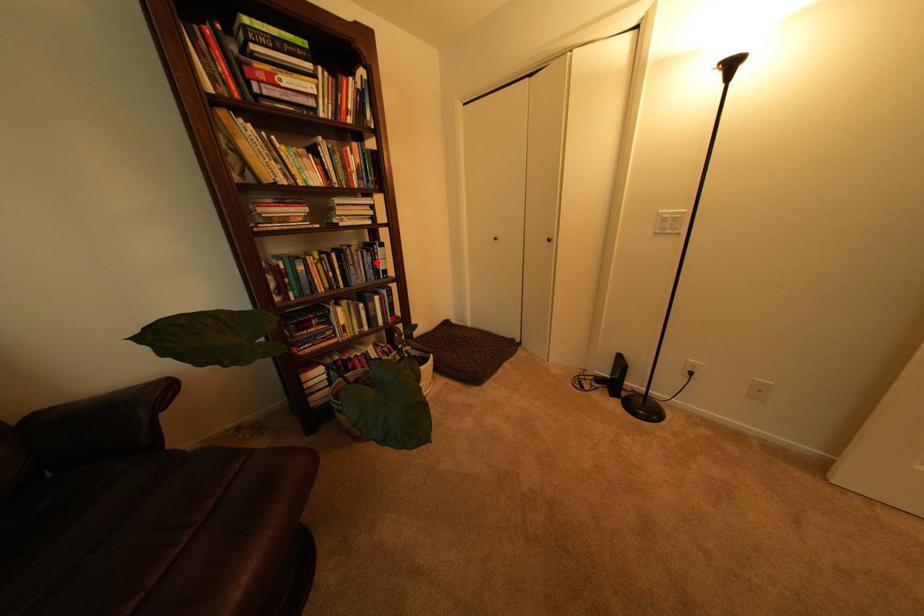
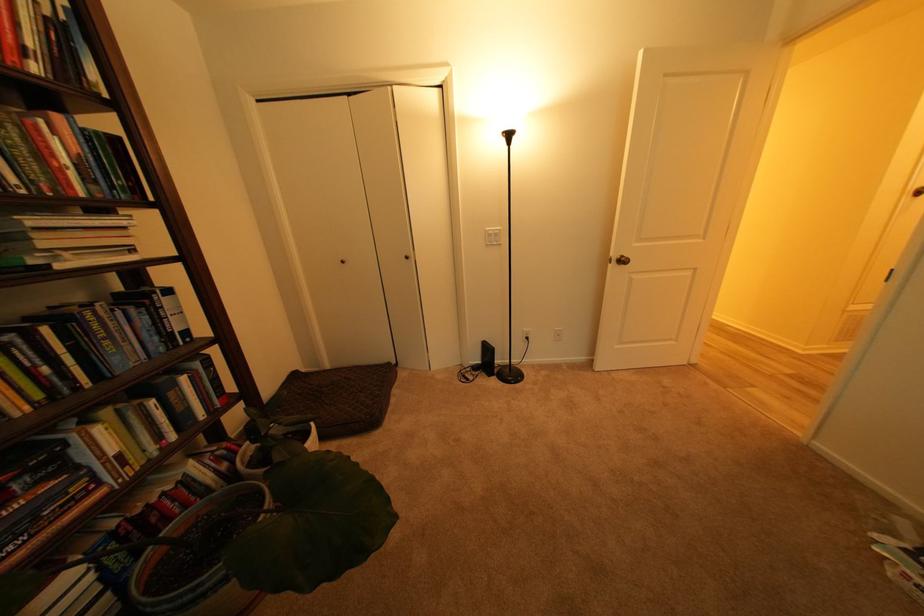
In the second image, find the point that corresponds to the highlighted location in the first image.

(150, 326)